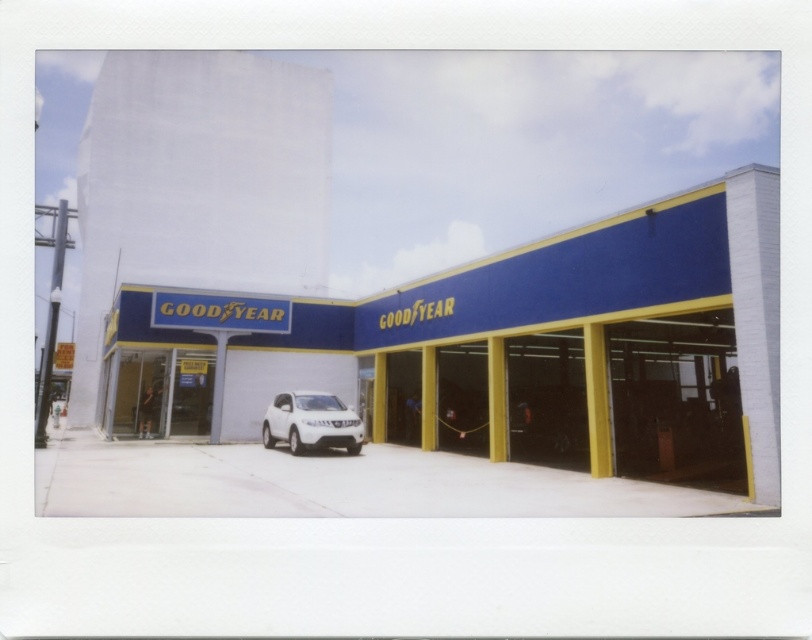
This screenshot has height=640, width=812. What do you see at coordinates (568, 348) in the screenshot? I see `blue/white goodyear sign at center` at bounding box center [568, 348].

This screenshot has height=640, width=812. What do you see at coordinates (568, 348) in the screenshot? I see `blue/white goodyear sign at center` at bounding box center [568, 348].

Where is `blue/white goodyear sign at center`? Image resolution: width=812 pixels, height=640 pixels. blue/white goodyear sign at center is located at coordinates (568, 348).